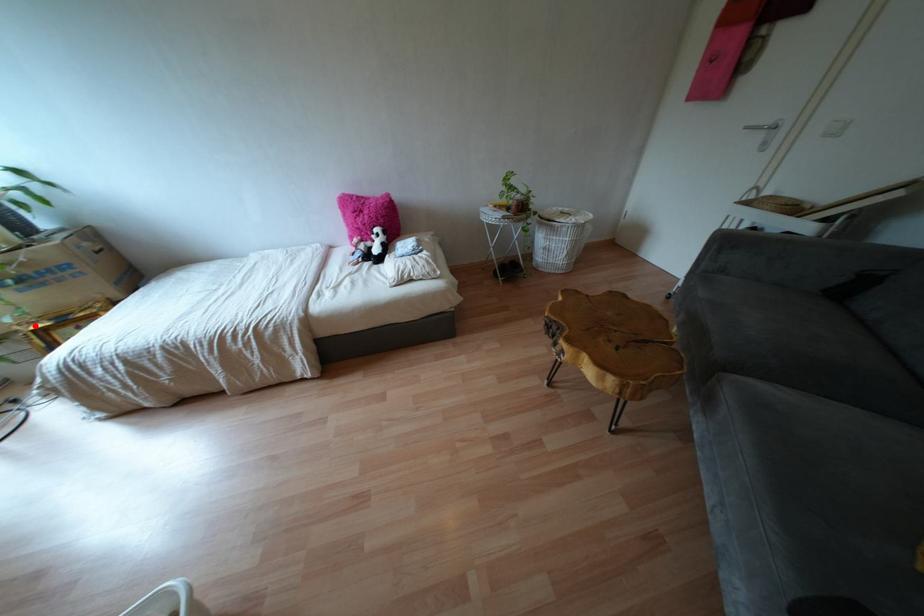
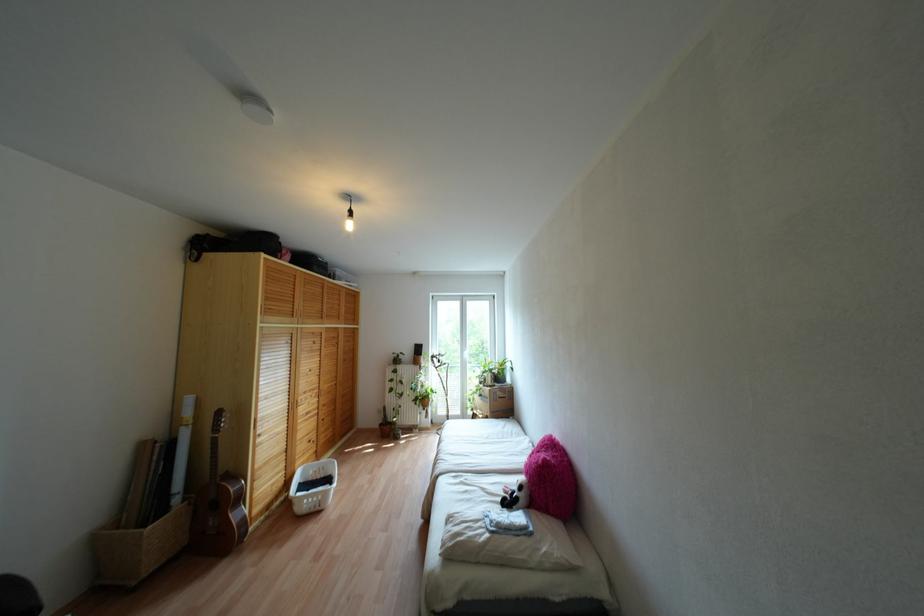
In the second image, find the point that corresponds to the highlighted location in the first image.

(473, 411)